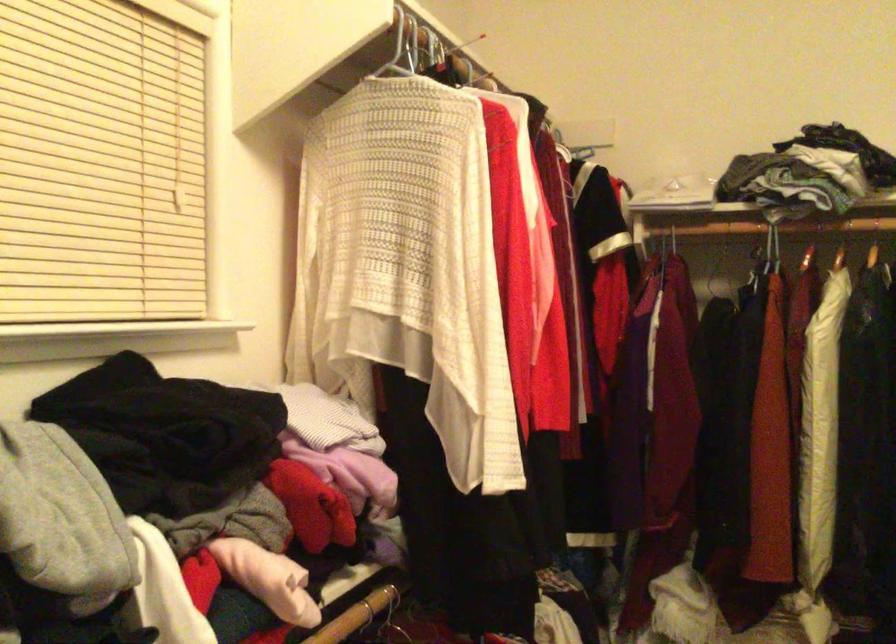
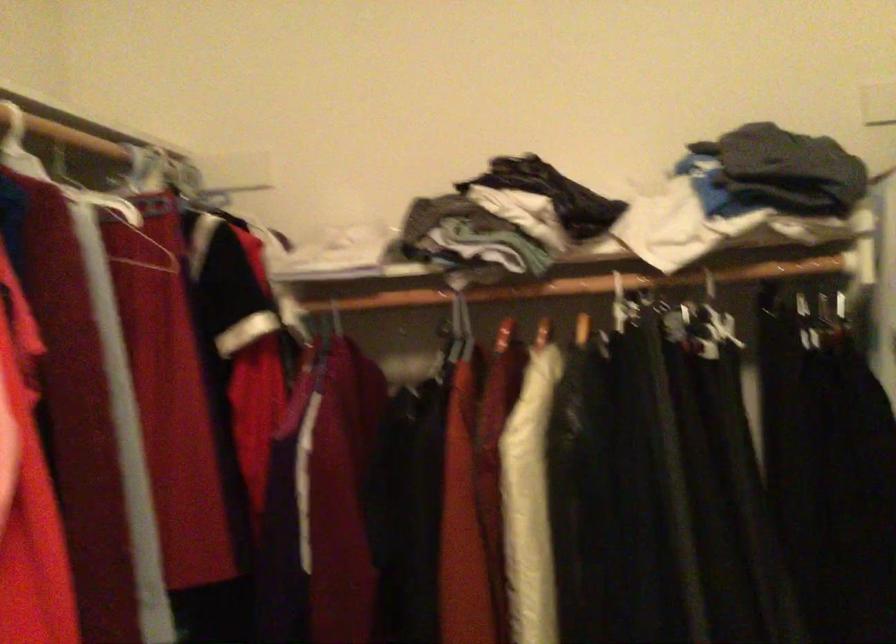
The images are taken continuously from a first-person perspective. In which direction are you moving?

The movement direction of the cameraman is right, forward.